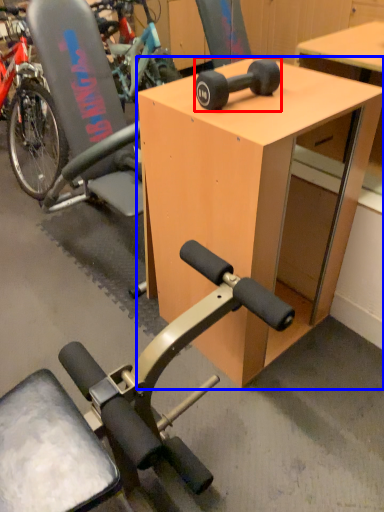
Question: Which point is closer to the camera, wheel (highlighted by a red box) or desk (highlighted by a blue box)?

Choices:
 (A) wheel
 (B) desk

Answer: (B)